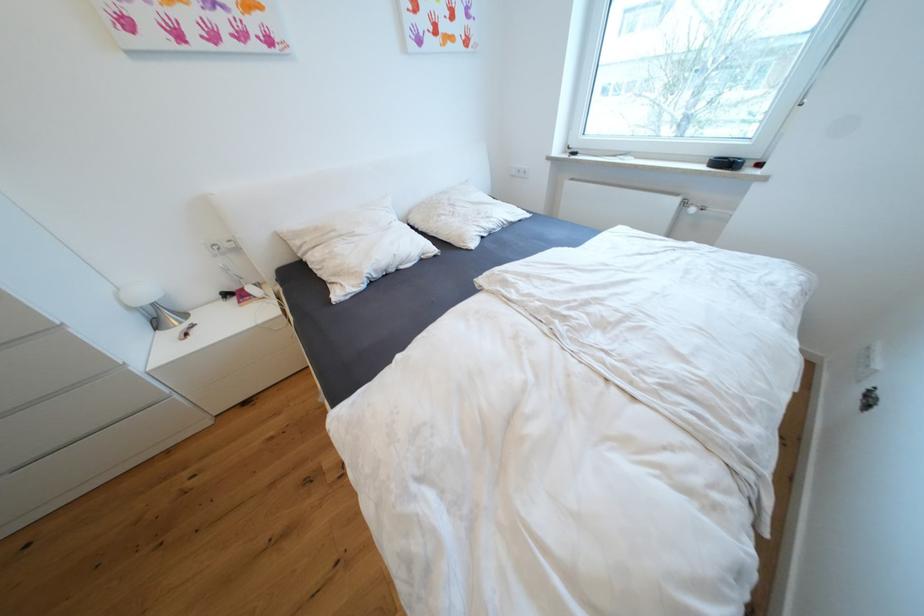
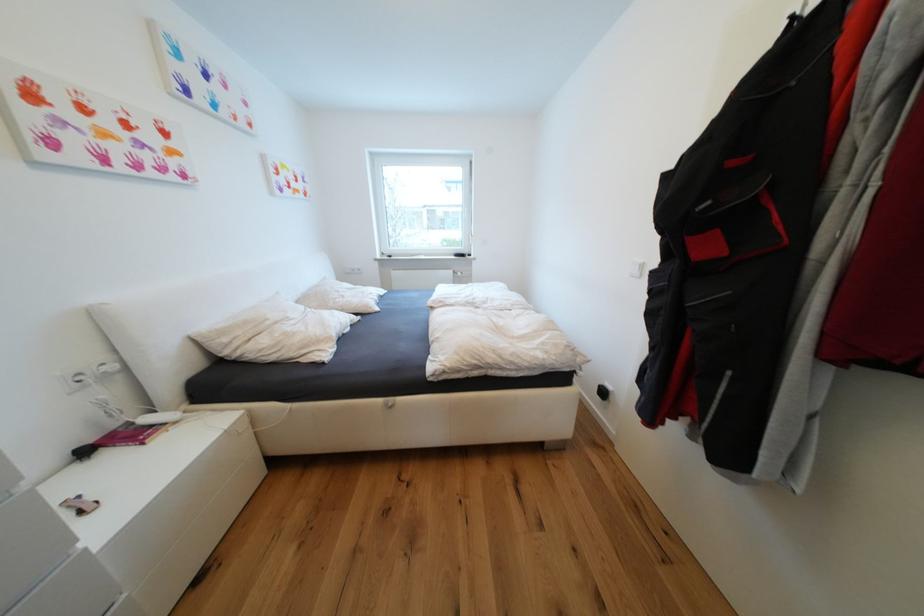
In the second image, find the point that corresponds to (460,215) in the first image.

(349, 297)